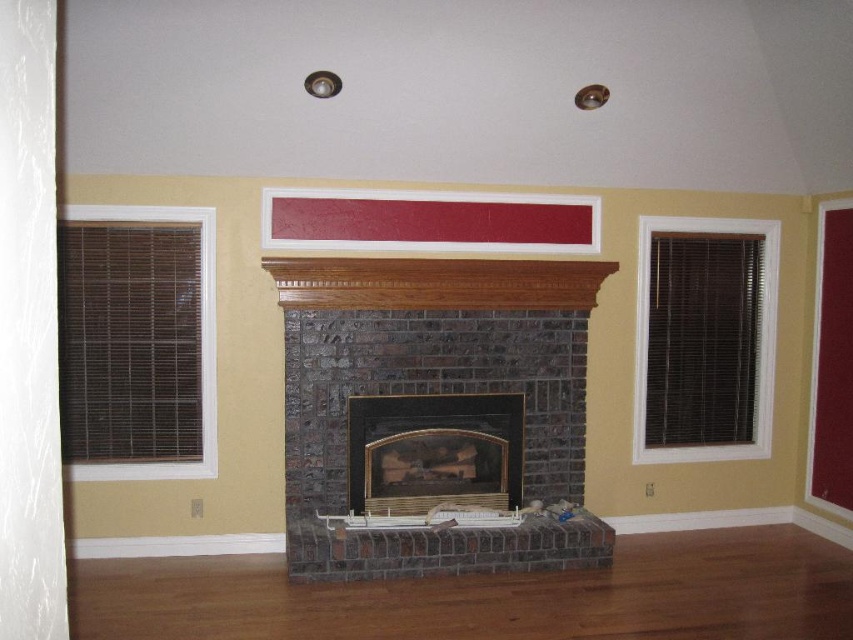
Question: Does dark gray brick fireplace at center have a greater width compared to brick fireplace at center?

Choices:
 (A) yes
 (B) no

Answer: (A)

Question: Does dark gray brick fireplace at center appear under brick fireplace at center?

Choices:
 (A) no
 (B) yes

Answer: (A)

Question: Is dark gray brick fireplace at center bigger than brick fireplace at center?

Choices:
 (A) no
 (B) yes

Answer: (B)

Question: Which point is closer to the camera?

Choices:
 (A) (321, 401)
 (B) (350, 486)

Answer: (A)

Question: Which point appears closest to the camera in this image?

Choices:
 (A) (x=544, y=497)
 (B) (x=426, y=452)

Answer: (B)

Question: Which point appears closest to the camera in this image?

Choices:
 (A) (292, 312)
 (B) (450, 410)

Answer: (A)